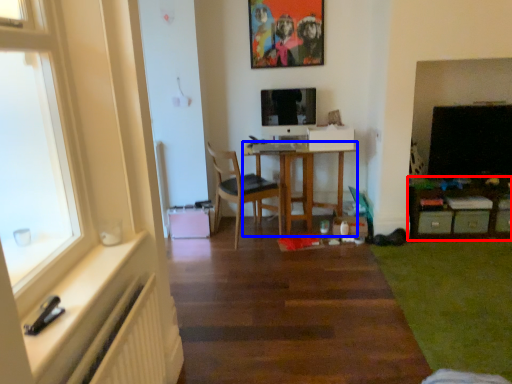
Question: Which object is closer to the camera taking this photo, table (highlighted by a red box) or desk (highlighted by a blue box)?

Choices:
 (A) table
 (B) desk

Answer: (A)